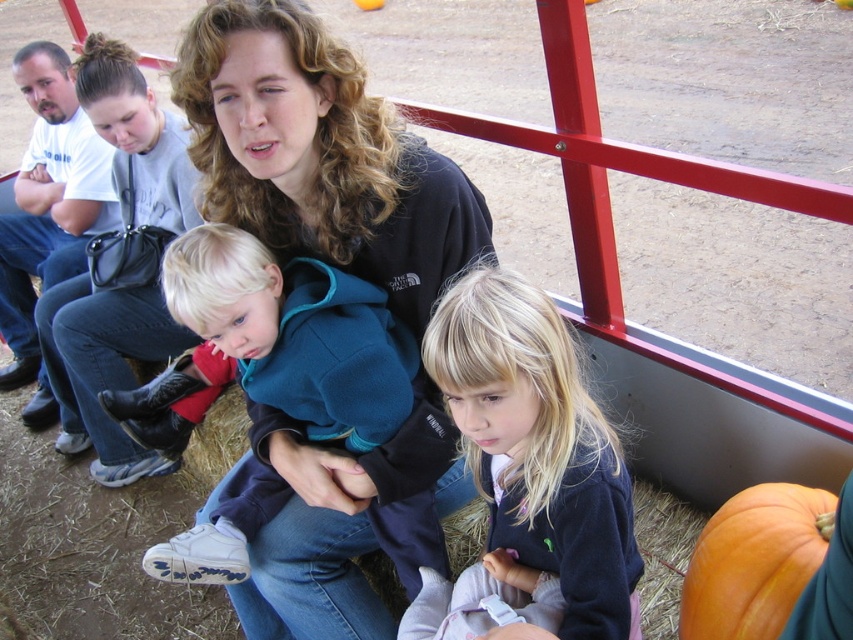
You are helping to organize a hayride and need to ensure that the black fleece at center and the red denim boot at left are placed in order of their height. Which object should be placed first if you are arranging them from shortest to tallest?

The black fleece at center has a lesser height compared to the red denim boot at left, so it should be placed first in the arrangement from shortest to tallest.

You are a photographer trying to capture a candid shot of the two children in the scene. The black fleece at center and the blonde hair at center are both in the frame. Based on their sizes in the image, which object would you focus on first if you want to ensure the larger subject is in focus?

The black fleece at center has a greater width than the blonde hair at center, so focusing on the black fleece at center first would ensure the larger subject is in focus.